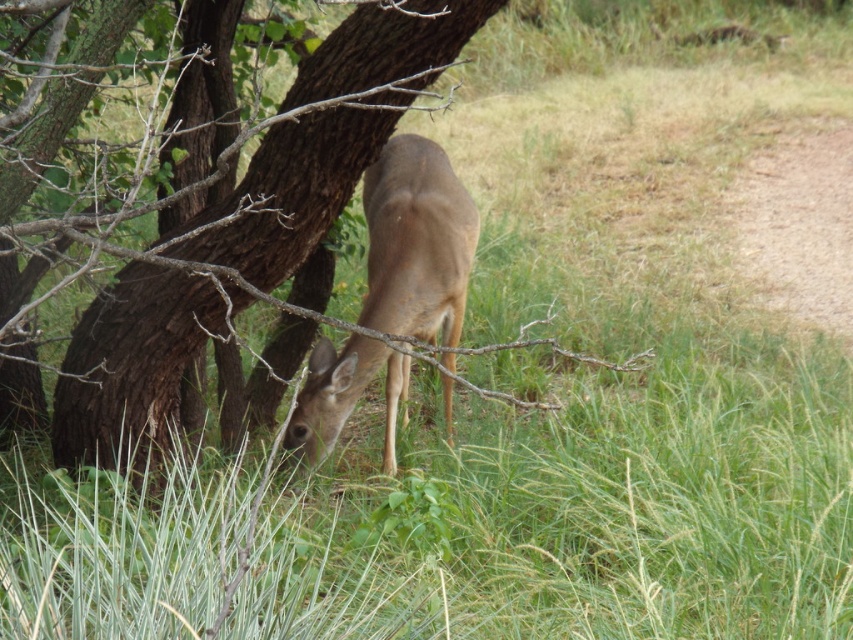
Question: Does brown rough bark tree at center come behind brown matte/deer at center?

Choices:
 (A) yes
 (B) no

Answer: (B)

Question: Does brown rough bark tree at center appear on the right side of brown matte/deer at center?

Choices:
 (A) yes
 (B) no

Answer: (B)

Question: Which object appears farthest from the camera in this image?

Choices:
 (A) brown matte/deer at center
 (B) brown rough bark tree at center

Answer: (A)

Question: Is brown rough bark tree at center bigger than brown matte/deer at center?

Choices:
 (A) yes
 (B) no

Answer: (A)